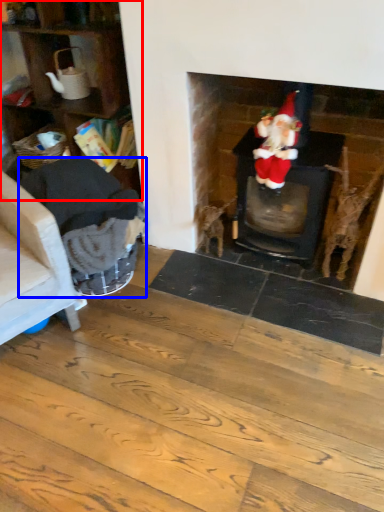
Question: Among these objects, which one is farthest to the camera, shelf (highlighted by a red box) or armchair (highlighted by a blue box)?

Choices:
 (A) shelf
 (B) armchair

Answer: (A)